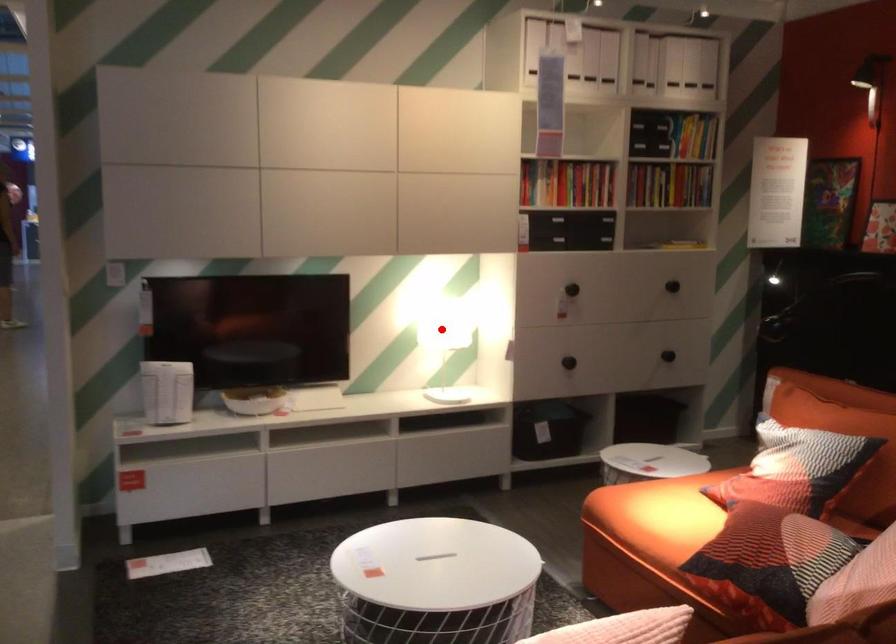
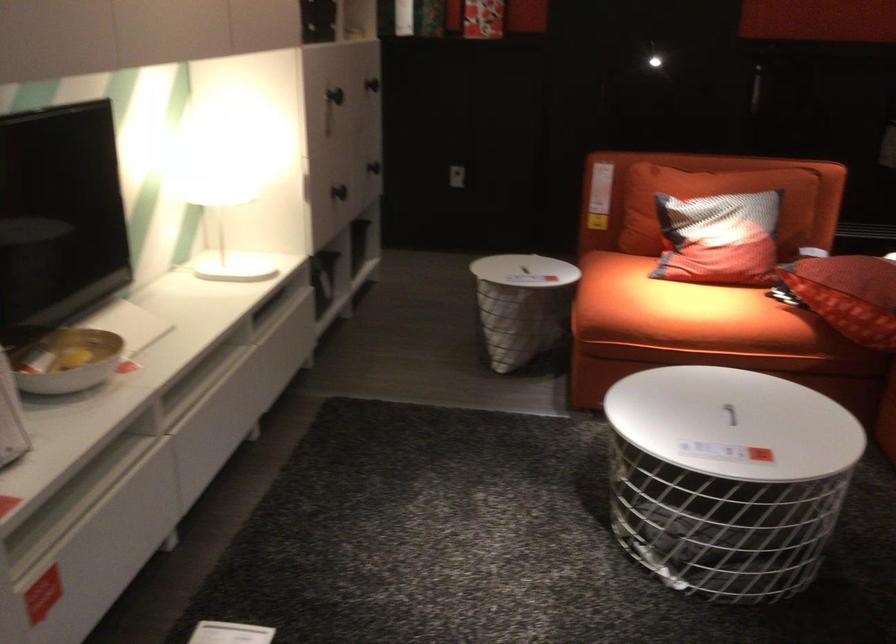
Find the pixel in the second image that matches the highlighted location in the first image.

(199, 198)